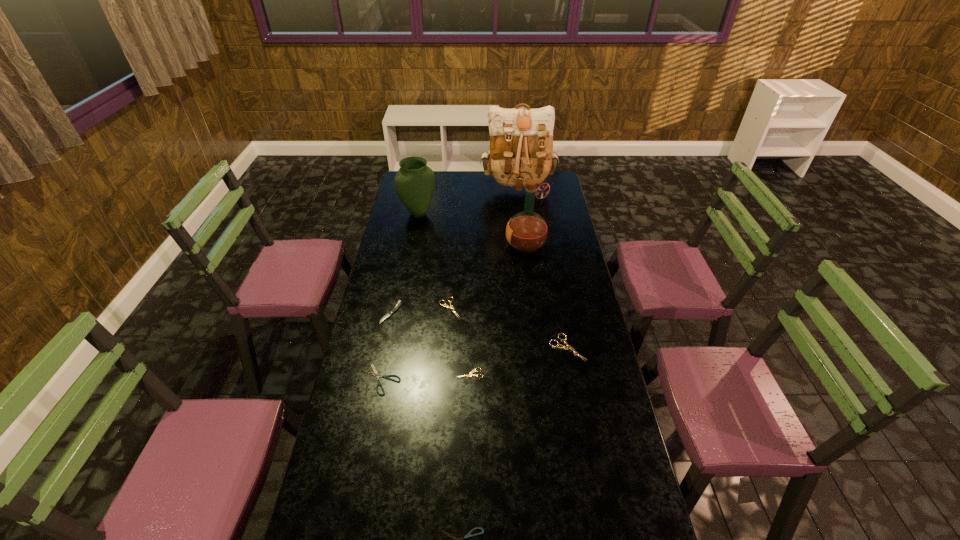
Where is `the second biggest beige shears`? This screenshot has width=960, height=540. the second biggest beige shears is located at coordinates (447, 306).

In order to click on the leftmost shears in this screenshot , I will do `click(375, 373)`.

You are a GUI agent. You are given a task and a screenshot of the screen. Output one action in this format:
    pyautogui.click(x=<x>, y=<y>)
    Task: Click on the farther black shears
    The width and height of the screenshot is (960, 540).
    Given the screenshot: What is the action you would take?
    pyautogui.click(x=375, y=373)

Identify the location of the nearest beige shears. (471, 373).

The height and width of the screenshot is (540, 960). I want to click on free space located 0.140m on the front-facing side of the backpack, so click(x=521, y=221).

Image resolution: width=960 pixels, height=540 pixels. I want to click on free space located on the front label of the liquor, so click(484, 245).

Image resolution: width=960 pixels, height=540 pixels. I want to click on vacant space located on the front label of the liquor, so click(x=444, y=245).

Identify the location of vacant space located 0.060m on the front label of the liquor. The width and height of the screenshot is (960, 540). (492, 245).

This screenshot has width=960, height=540. I want to click on vacant space located on the back of the green vase, so click(424, 181).

This screenshot has height=540, width=960. In order to click on vacant area located 0.270m on the right of the pocketknife in this screenshot , I will do `click(468, 313)`.